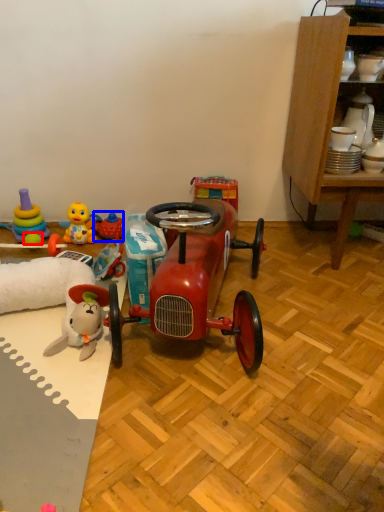
Question: Which object is closer to the camera taking this photo, toy (highlighted by a red box) or toy (highlighted by a blue box)?

Choices:
 (A) toy
 (B) toy

Answer: (A)